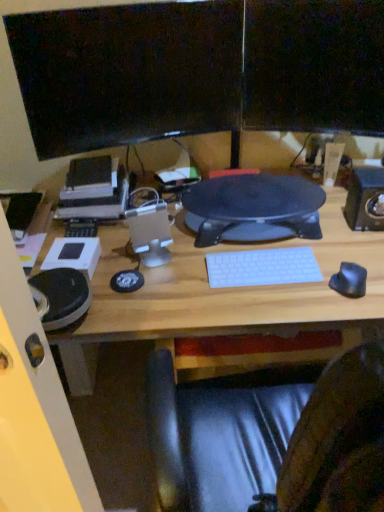
What are the coordinates of `vacant space situated on the left part of white plastic keyboard at center` in the screenshot? It's located at (183, 277).